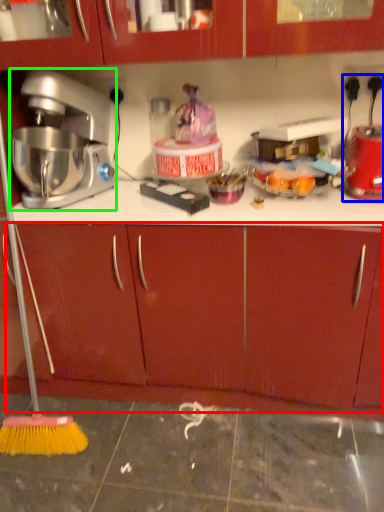
Question: Which is nearer to the drawer (highlighted by a red box)? blender (highlighted by a blue box) or mixer (highlighted by a green box).

Choices:
 (A) blender
 (B) mixer

Answer: (B)